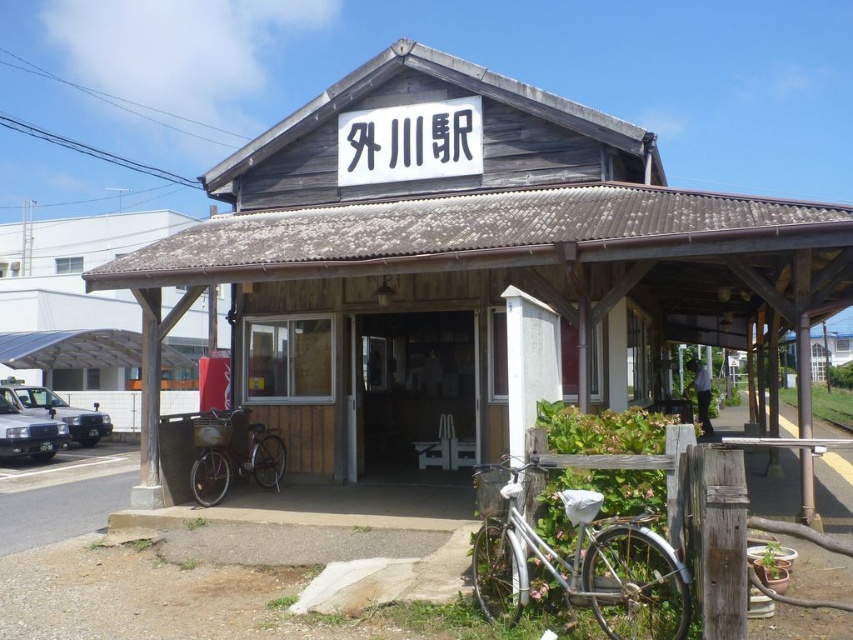
You are standing in front of the Kawagawa Station building and see two points marked on the ground. The first point is at coordinate point (x=521, y=196) and the second is at point (x=86, y=410). Which point is closer to your current position?

Point (x=521, y=196) is closer to the viewer than point (x=86, y=410), so the first point is closer to your current position.

You are a delivery person trying to park your motorcycle between the weathered wood hut at center and the silver metallic bicycle at center. Can you fit your motorcycle there?

The weathered wood hut at center is positioned over the silver metallic bicycle at center, meaning there is no space between them. Therefore, you cannot fit your motorcycle between them.

You are standing at the entrance of the weathered wood hut at center and want to move the silver metallic bicycle at lower right to a spot closer to the hut. Based on their positions, can you move the bicycle directly forward without moving it sideways?

The weathered wood hut at center is located above silver metallic bicycle at lower right, meaning the bicycle is positioned lower in the scene. Since the bicycle is already near the foreground and the hut is above it, moving it directly forward would bring it closer to the hut without needing to move sideways.